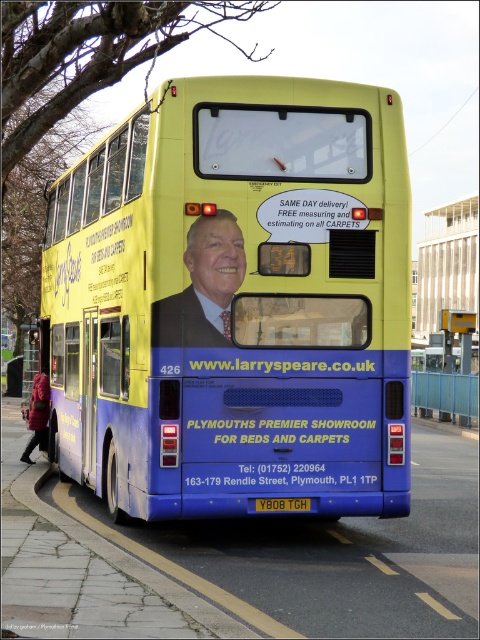
Question: Which object is the farthest from the smooth suit at center?

Choices:
 (A) yellow matte bus at center
 (B) yellow metallic license plate at center

Answer: (B)

Question: Is smooth suit at center thinner than yellow metallic license plate at center?

Choices:
 (A) yes
 (B) no

Answer: (B)

Question: Can you confirm if smooth suit at center is wider than yellow metallic license plate at center?

Choices:
 (A) no
 (B) yes

Answer: (B)

Question: Which point is closer to the camera?

Choices:
 (A) yellow matte bus at center
 (B) smooth suit at center

Answer: (B)

Question: Which of the following is the closest to the observer?

Choices:
 (A) (276, 509)
 (B) (217, 312)
 (C) (370, 100)

Answer: (B)

Question: Is the position of yellow matte bus at center more distant than that of smooth suit at center?

Choices:
 (A) yes
 (B) no

Answer: (A)